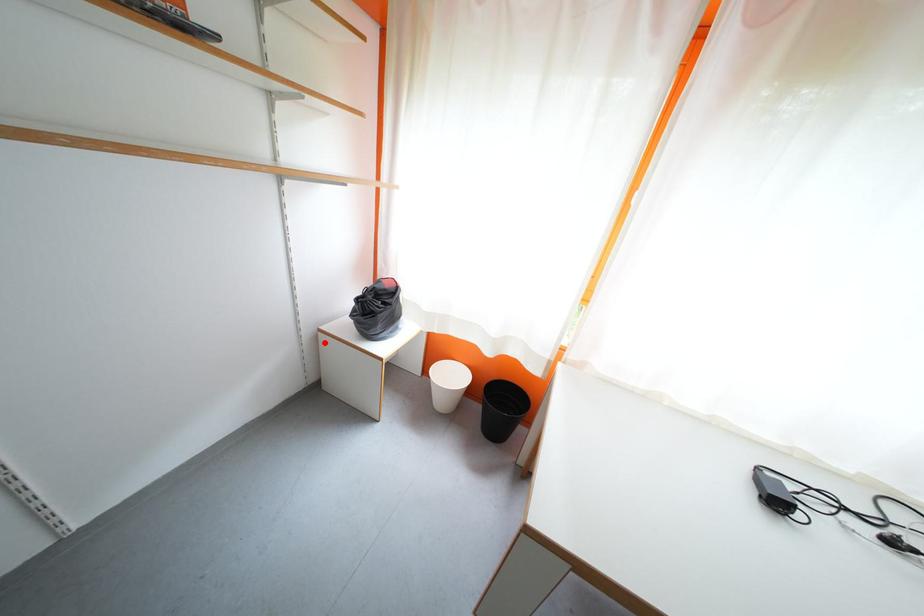
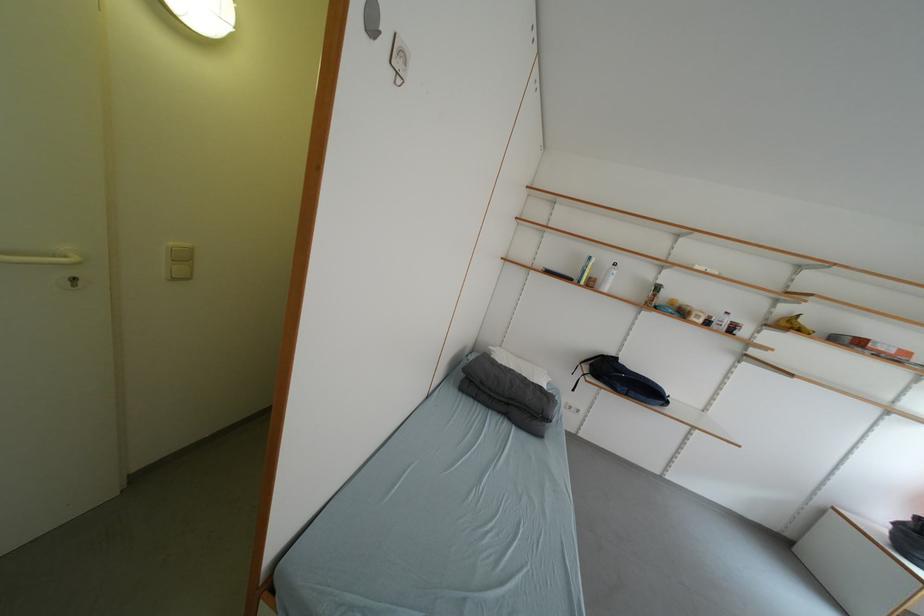
Question: I am providing you with two images of the same scene from different viewpoints. Given a red point in image1, look at the same physical point in image2. Is it:

Choices:
 (A) Closer to the viewpoint
 (B) Farther from the viewpoint

Answer: (A)